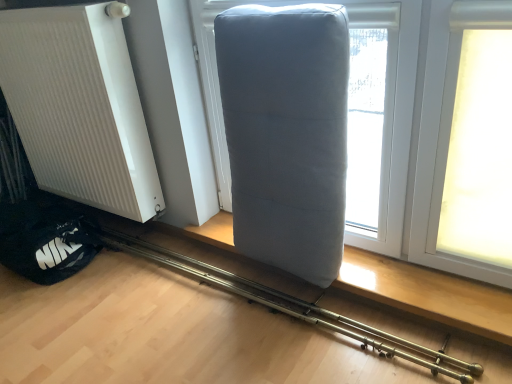
What are the coordinates of `vacant area situated to the left side of matte gray pillow at center` in the screenshot? It's located at (123, 307).